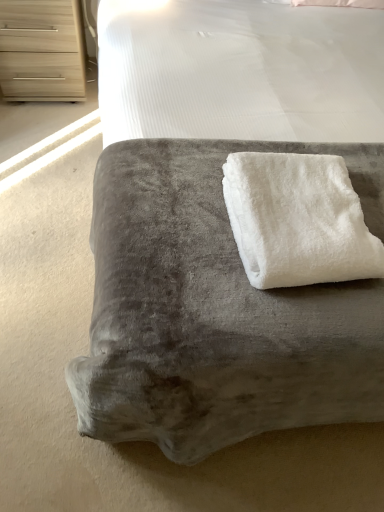
At what (x,y) coordinates should I click in order to perform the action: click on free space to the left of white fluffy towel at center. Please return your answer as a coordinate pair (x, y). The height and width of the screenshot is (512, 384). Looking at the image, I should click on (175, 212).